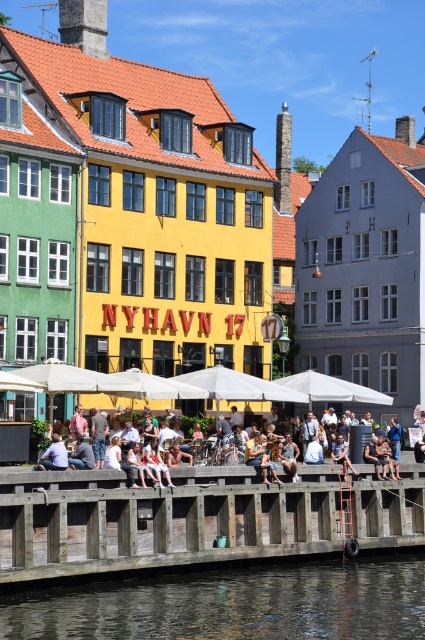
Question: From the image, what is the correct spatial relationship of wooden dock at center in relation to light blue denim jeans at center?

Choices:
 (A) left
 (B) right

Answer: (B)

Question: Does wooden dock at center have a larger size compared to light blue denim jeans at center?

Choices:
 (A) yes
 (B) no

Answer: (A)

Question: Does transparent water at lower center have a larger size compared to light blue denim jeans at center?

Choices:
 (A) yes
 (B) no

Answer: (B)

Question: Which object is the closest to the light blue denim jeans at center?

Choices:
 (A) transparent water at lower center
 (B) wooden dock at center

Answer: (B)

Question: Among these objects, which one is nearest to the camera?

Choices:
 (A) transparent water at lower center
 (B) light blue denim jeans at center

Answer: (A)

Question: Based on their relative distances, which object is nearer to the light blue denim jeans at center?

Choices:
 (A) transparent water at lower center
 (B) wooden dock at center

Answer: (B)